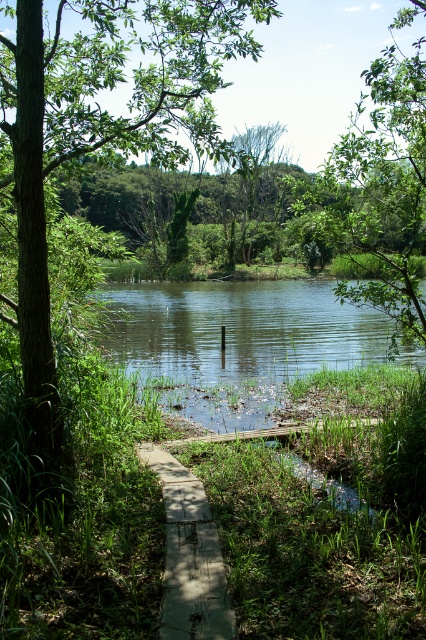
Does green leafy tree at center have a smaller size compared to green grassy river at center?

No, green leafy tree at center is not smaller than green grassy river at center.

Who is more forward, (66, 147) or (189, 416)?

Point (66, 147)

Where is `green leafy tree at center`? This screenshot has width=426, height=640. green leafy tree at center is located at coordinates (100, 132).

Between point (210, 413) and point (218, 554), which one is positioned in front?

Point (218, 554) is more forward.

Describe the element at coordinates (236, 340) in the screenshot. I see `green grassy river at center` at that location.

Find the location of a particular element. Image resolution: width=426 pixels, height=640 pixels. green grassy river at center is located at coordinates (236, 340).

Is green leafy tree at center above wooden plank at center?

Correct, green leafy tree at center is located above wooden plank at center.

Who is positioned more to the right, green leafy tree at center or wooden plank at center?

wooden plank at center

What are the coordinates of `green leafy tree at center` in the screenshot? It's located at (100, 132).

Identify the location of green leafy tree at center. This screenshot has height=640, width=426. (100, 132).